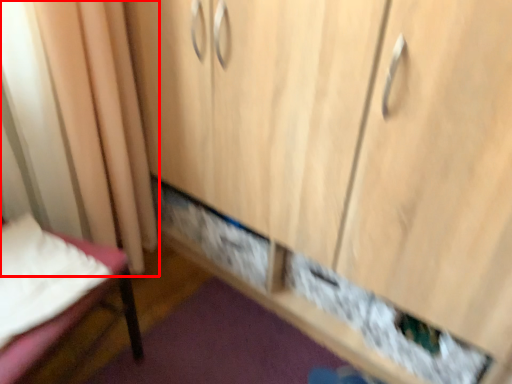
Question: Observing the image, what is the correct spatial positioning of curtain (annotated by the red box) in reference to furniture?

Choices:
 (A) right
 (B) left

Answer: (A)